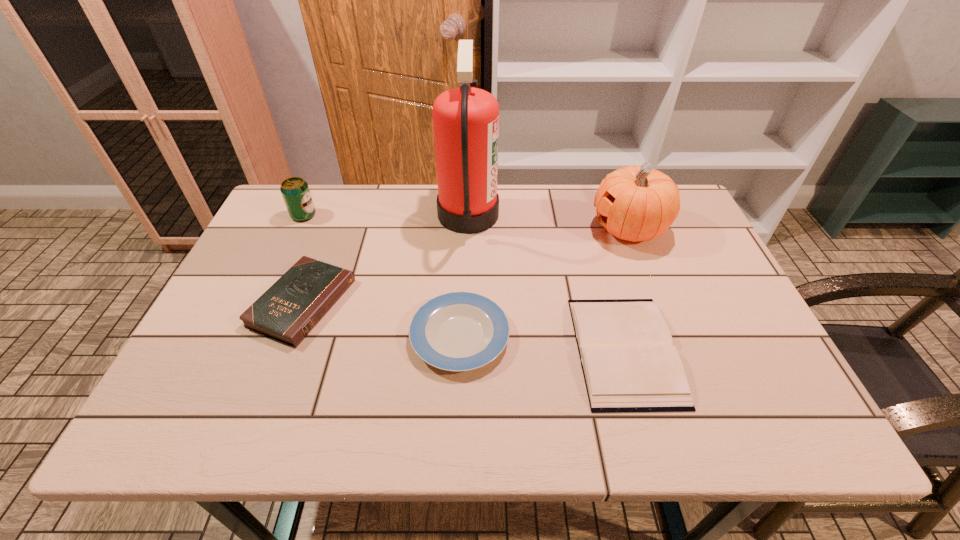
This screenshot has height=540, width=960. In order to click on vacant region located on the right of the beer can in this screenshot , I will do `click(401, 215)`.

Where is `free space located on the back of the Bible`? This screenshot has width=960, height=540. free space located on the back of the Bible is located at coordinates (330, 230).

Find the location of a particular element. This screenshot has height=540, width=960. blank space located on the left of the hardback book is located at coordinates (467, 350).

Find the location of a particular element. This screenshot has height=540, width=960. free point located on the left of the plate is located at coordinates (285, 336).

Identify the location of fire extinguisher that is at the far edge. The height and width of the screenshot is (540, 960). (465, 120).

Identify the location of pumpkin present at the far edge. (636, 203).

You are a GUI agent. You are given a task and a screenshot of the screen. Output one action in this format:
    pyautogui.click(x=<x>, y=<y>)
    Task: Click on the beer can that is at the far edge
    The height and width of the screenshot is (540, 960).
    Given the screenshot: What is the action you would take?
    pyautogui.click(x=295, y=191)

Find the location of `object located in the near edge section of the desktop`. object located in the near edge section of the desktop is located at coordinates (629, 364).

Find the location of a particular element. beer can at the left edge is located at coordinates (295, 191).

Find the location of a particular element. The image size is (960, 540). Bible located in the left edge section of the desktop is located at coordinates (288, 311).